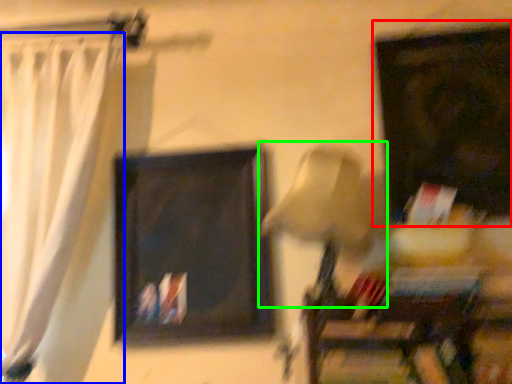
Question: Which is farther away from picture frame (highlighted by a red box)? curtain (highlighted by a blue box) or table lamp (highlighted by a green box)?

Choices:
 (A) curtain
 (B) table lamp

Answer: (A)